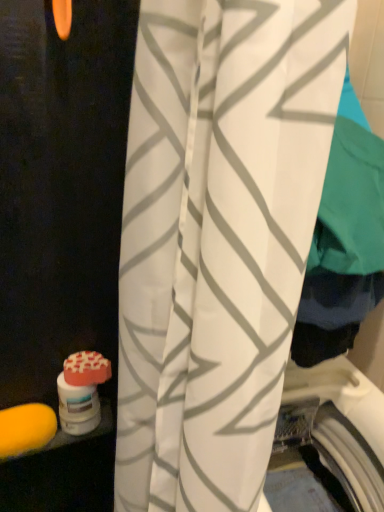
What is the approximate width of white fabric curtain at center?

The width of white fabric curtain at center is 24.24 centimeters.

Image resolution: width=384 pixels, height=512 pixels. Identify the location of white fabric curtain at center. (218, 238).

Which is in front, point (35, 434) or point (88, 357)?

Point (35, 434)

Is yellow sponge at lower left, the 1th soap in the left-to-right sequence, outside of orange matte soap at lower left, which appears as the 1th soap when viewed from the top?

Absolutely, yellow sponge at lower left, the 1th soap in the left-to-right sequence, is external to orange matte soap at lower left, which appears as the 1th soap when viewed from the top.

Considering the relative sizes of yellow sponge at lower left, the 1th soap in the left-to-right sequence, and orange matte soap at lower left, arranged as the first soap when viewed from the right, in the image provided, is yellow sponge at lower left, the 1th soap in the left-to-right sequence, smaller than orange matte soap at lower left, arranged as the first soap when viewed from the right,?

No.

Is yellow sponge at lower left, placed as the first soap when sorted from bottom to top, oriented away from orange matte soap at lower left, the 2th soap from the bottom?

No, yellow sponge at lower left, placed as the first soap when sorted from bottom to top,'s orientation is not away from orange matte soap at lower left, the 2th soap from the bottom.

Which object is positioned more to the right, white fabric curtain at center or orange matte soap at lower left, which is the second soap in left-to-right order?

Positioned to the right is white fabric curtain at center.

This screenshot has height=512, width=384. Find the location of `curtain that appears above the orange matte soap at lower left, which appears as the 1th soap when viewed from the top (from a real-world perspective)`. curtain that appears above the orange matte soap at lower left, which appears as the 1th soap when viewed from the top (from a real-world perspective) is located at coordinates (218, 238).

Is point (155, 488) positioned behind point (90, 368)?

No, (155, 488) is closer to viewer.

Who is bigger, white fabric curtain at center or orange matte soap at lower left, arranged as the first soap when viewed from the right?

white fabric curtain at center is bigger.

How much distance is there between orange matte soap at lower left, arranged as the first soap when viewed from the right, and white fabric curtain at center?

orange matte soap at lower left, arranged as the first soap when viewed from the right, is 21.33 inches from white fabric curtain at center.

From a real-world perspective, is orange matte soap at lower left, the 2th soap from the bottom, physically located above or below white fabric curtain at center?

orange matte soap at lower left, the 2th soap from the bottom, is below white fabric curtain at center.

Does orange matte soap at lower left, which is the second soap in left-to-right order, appear on the right side of white fabric curtain at center?

No.

In terms of height, does orange matte soap at lower left, the 2th soap from the bottom, look taller or shorter compared to white fabric curtain at center?

Considering their sizes, orange matte soap at lower left, the 2th soap from the bottom, has less height than white fabric curtain at center.

From the image's perspective, count 2nd soaps downward from the white fabric curtain at center and point to it. Please provide its 2D coordinates.

[(26, 429)]

Based on their sizes in the image, would you say white fabric curtain at center is bigger or smaller than yellow sponge at lower left, the 2th soap in the right-to-left sequence?

Considering their sizes, white fabric curtain at center takes up more space than yellow sponge at lower left, the 2th soap in the right-to-left sequence.

From the image's perspective, is white fabric curtain at center located above or below yellow sponge at lower left, the 2th soap in the right-to-left sequence?

white fabric curtain at center is above yellow sponge at lower left, the 2th soap in the right-to-left sequence.

Who is taller, white fabric curtain at center or yellow sponge at lower left, the 1th soap in the left-to-right sequence?

white fabric curtain at center.

Could you tell me if orange matte soap at lower left, the 2th soap from the bottom, is turned towards yellow sponge at lower left, placed as the first soap when sorted from bottom to top?

No, orange matte soap at lower left, the 2th soap from the bottom, is not oriented towards yellow sponge at lower left, placed as the first soap when sorted from bottom to top.

Who is bigger, orange matte soap at lower left, which appears as the 1th soap when viewed from the top, or yellow sponge at lower left, placed as the first soap when sorted from bottom to top?

Bigger between the two is yellow sponge at lower left, placed as the first soap when sorted from bottom to top.

From a real-world perspective, is orange matte soap at lower left, arranged as the first soap when viewed from the right, above or below yellow sponge at lower left, which is the second soap in top-to-bottom order?

orange matte soap at lower left, arranged as the first soap when viewed from the right, is situated higher than yellow sponge at lower left, which is the second soap in top-to-bottom order, in the real world.

From the picture: Is orange matte soap at lower left, the 2th soap from the bottom, further to camera compared to yellow sponge at lower left, the 2th soap in the right-to-left sequence?

That is True.

Which is more to the left, yellow sponge at lower left, the 1th soap in the left-to-right sequence, or white fabric curtain at center?

yellow sponge at lower left, the 1th soap in the left-to-right sequence, is more to the left.

Is yellow sponge at lower left, the 1th soap in the left-to-right sequence, aimed at white fabric curtain at center?

No, yellow sponge at lower left, the 1th soap in the left-to-right sequence, is not oriented towards white fabric curtain at center.

I want to click on soap behind the yellow sponge at lower left, the 2th soap in the right-to-left sequence, so tap(86, 369).

Where is `the 1st soap positioned below the white fabric curtain at center (from a real-world perspective)`? the 1st soap positioned below the white fabric curtain at center (from a real-world perspective) is located at coordinates (86, 369).

From the image, which object appears to be farther from white fabric curtain at center, yellow sponge at lower left, the 2th soap in the right-to-left sequence, or orange matte soap at lower left, which is the second soap in left-to-right order?

Based on the image, yellow sponge at lower left, the 2th soap in the right-to-left sequence, appears to be further to white fabric curtain at center.

Considering their positions, is orange matte soap at lower left, arranged as the first soap when viewed from the right, positioned further to yellow sponge at lower left, which is the second soap in top-to-bottom order, than white fabric curtain at center?

The object further to yellow sponge at lower left, which is the second soap in top-to-bottom order, is white fabric curtain at center.

Based on their spatial positions, is orange matte soap at lower left, the 2th soap from the bottom, or yellow sponge at lower left, the 1th soap in the left-to-right sequence, further from white fabric curtain at center?

yellow sponge at lower left, the 1th soap in the left-to-right sequence.

Considering their positions, is yellow sponge at lower left, the 1th soap in the left-to-right sequence, positioned closer to orange matte soap at lower left, the 2th soap from the bottom, than white fabric curtain at center?

yellow sponge at lower left, the 1th soap in the left-to-right sequence, lies closer to orange matte soap at lower left, the 2th soap from the bottom, than the other object.

When comparing their distances from yellow sponge at lower left, the 1th soap in the left-to-right sequence, does white fabric curtain at center or orange matte soap at lower left, which appears as the 1th soap when viewed from the top, seem further?

Among the two, white fabric curtain at center is located further to yellow sponge at lower left, the 1th soap in the left-to-right sequence.

Looking at the image, which one is located further to orange matte soap at lower left, which is the second soap in left-to-right order, white fabric curtain at center or yellow sponge at lower left, which is the second soap in top-to-bottom order?

white fabric curtain at center is positioned further to the anchor orange matte soap at lower left, which is the second soap in left-to-right order.

Locate an element on the screen. The width and height of the screenshot is (384, 512). soap between white fabric curtain at center and orange matte soap at lower left, which appears as the 1th soap when viewed from the top, along the z-axis is located at coordinates (26, 429).